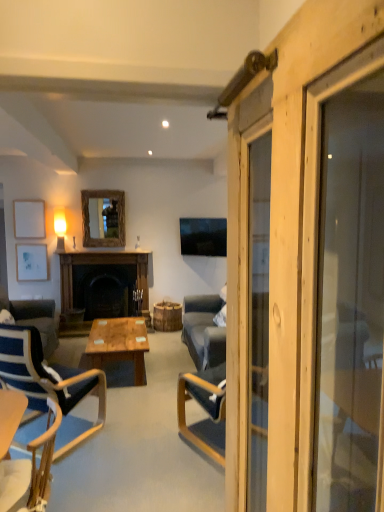
Question: Is wooden barn door at right smaller than white matte picture frame at left, the 1th picture frame ordered from the bottom?

Choices:
 (A) no
 (B) yes

Answer: (A)

Question: Is wooden barn door at right positioned with its back to white matte picture frame at left, positioned as the second picture frame in top-to-bottom order?

Choices:
 (A) no
 (B) yes

Answer: (A)

Question: Considering the relative positions of wooden barn door at right and white matte picture frame at left, positioned as the second picture frame in top-to-bottom order, in the image provided, is wooden barn door at right to the left of white matte picture frame at left, positioned as the second picture frame in top-to-bottom order, from the viewer's perspective?

Choices:
 (A) no
 (B) yes

Answer: (A)

Question: Is the position of wooden barn door at right more distant than that of white matte picture frame at left, positioned as the second picture frame in top-to-bottom order?

Choices:
 (A) no
 (B) yes

Answer: (A)

Question: From the image's perspective, is wooden barn door at right above white matte picture frame at left, the 1th picture frame ordered from the bottom?

Choices:
 (A) yes
 (B) no

Answer: (B)

Question: Considering the relative positions of wooden barn door at right and white matte picture frame at left, the 1th picture frame ordered from the bottom, in the image provided, is wooden barn door at right to the right of white matte picture frame at left, the 1th picture frame ordered from the bottom, from the viewer's perspective?

Choices:
 (A) no
 (B) yes

Answer: (B)

Question: Is white matte picture frame at left, the 1th picture frame ordered from the bottom, looking in the opposite direction of wooden barn door at right?

Choices:
 (A) yes
 (B) no

Answer: (B)

Question: Does white matte picture frame at left, the 1th picture frame ordered from the bottom, have a lesser width compared to wooden barn door at right?

Choices:
 (A) yes
 (B) no

Answer: (A)

Question: Does white matte picture frame at left, positioned as the second picture frame in top-to-bottom order, appear on the right side of wooden barn door at right?

Choices:
 (A) no
 (B) yes

Answer: (A)

Question: Can you confirm if white matte picture frame at left, positioned as the second picture frame in top-to-bottom order, is shorter than wooden barn door at right?

Choices:
 (A) no
 (B) yes

Answer: (B)

Question: From a real-world perspective, is white matte picture frame at left, the 1th picture frame ordered from the bottom, located higher than wooden barn door at right?

Choices:
 (A) no
 (B) yes

Answer: (A)

Question: From a real-world perspective, is white matte picture frame at left, the 1th picture frame ordered from the bottom, beneath wooden barn door at right?

Choices:
 (A) no
 (B) yes

Answer: (B)

Question: From a real-world perspective, is white matte picture frame at left, positioned as the second picture frame in top-to-bottom order, over blue fabric chair at left, which is the 1th chair in back-to-front order?

Choices:
 (A) yes
 (B) no

Answer: (A)